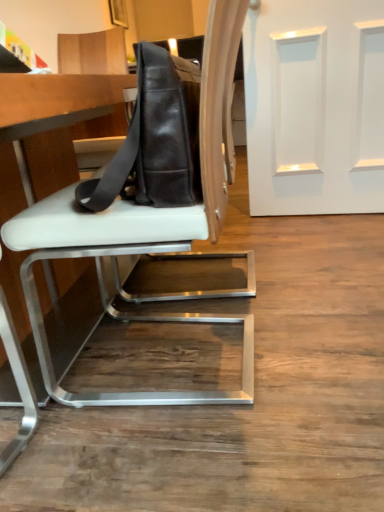
The image size is (384, 512). What are the coordinates of `vacant area that is in front of white leather chair at center` in the screenshot? It's located at (199, 449).